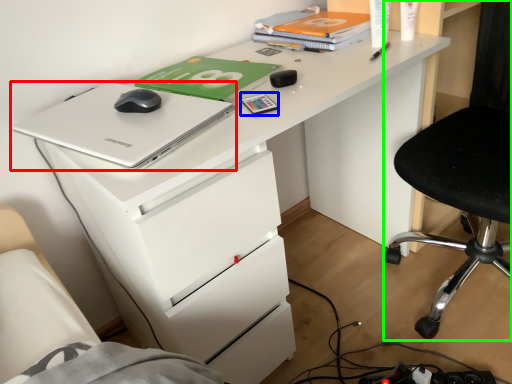
Question: Which object is the closest to the laptop (highlighted by a red box)? Choose among these: stationery (highlighted by a blue box) or chair (highlighted by a green box).

Choices:
 (A) stationery
 (B) chair

Answer: (A)